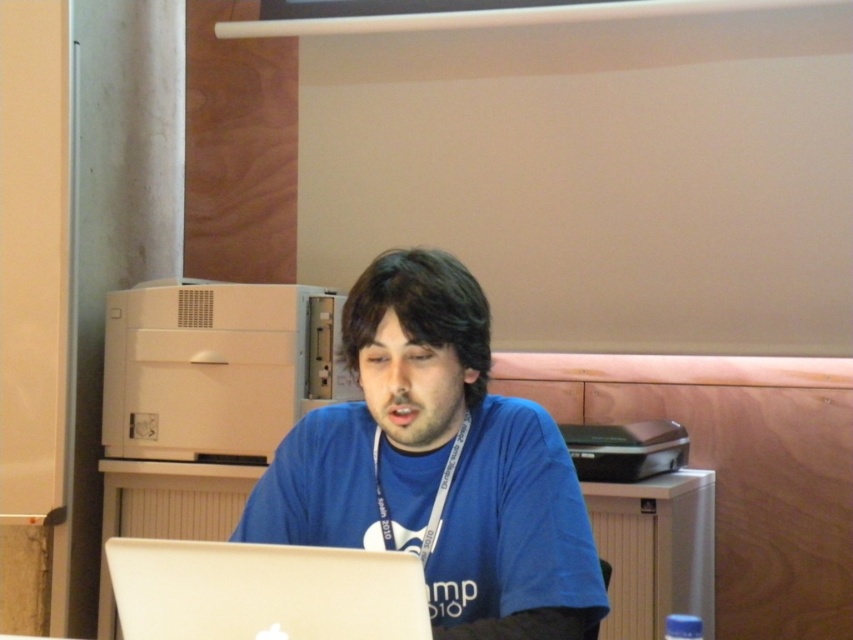
Question: Is blue fabric shirt at center bigger than silver metallic laptop at lower center?

Choices:
 (A) no
 (B) yes

Answer: (B)

Question: Which of the following is the farthest from the observer?

Choices:
 (A) (473, 278)
 (B) (380, 616)

Answer: (A)

Question: Can you confirm if blue fabric shirt at center is thinner than silver metallic laptop at lower center?

Choices:
 (A) yes
 (B) no

Answer: (B)

Question: Which object is farther from the camera taking this photo?

Choices:
 (A) blue fabric shirt at center
 (B) silver metallic laptop at lower center

Answer: (A)

Question: Which point is farther to the camera?

Choices:
 (A) (451, 404)
 (B) (410, 625)

Answer: (A)

Question: Is the position of blue fabric shirt at center more distant than that of silver metallic laptop at lower center?

Choices:
 (A) no
 (B) yes

Answer: (B)